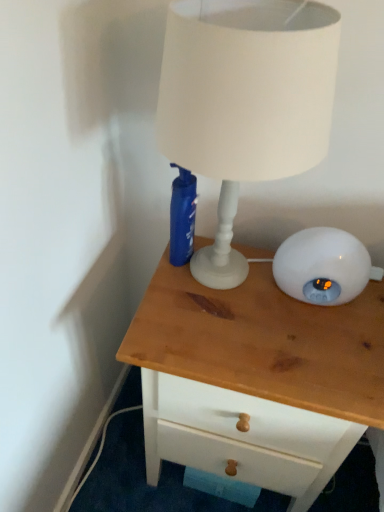
Measure the distance between wooden chest of drawers at center and camera.

wooden chest of drawers at center and camera are 26.26 inches apart.

The image size is (384, 512). What are the coordinates of `wooden chest of drawers at center` in the screenshot? It's located at (265, 343).

What do you see at coordinates (265, 343) in the screenshot? I see `wooden chest of drawers at center` at bounding box center [265, 343].

At what (x,y) coordinates should I click in order to perform the action: click on white matte lampshade at upper center. Please return your answer as a coordinate pair (x, y). The height and width of the screenshot is (512, 384). Looking at the image, I should click on (245, 102).

Describe the element at coordinates (245, 102) in the screenshot. I see `white matte lampshade at upper center` at that location.

Locate an element on the screen. wooden chest of drawers at center is located at coordinates (265, 343).

From the picture: Can you confirm if white matte lampshade at upper center is positioned to the right of wooden chest of drawers at center?

Incorrect, white matte lampshade at upper center is not on the right side of wooden chest of drawers at center.

Who is more distant, white matte lampshade at upper center or wooden chest of drawers at center?

wooden chest of drawers at center is further away from the camera.

Considering the positions of points (219, 172) and (132, 327), is point (219, 172) closer to camera compared to point (132, 327)?

Yes, point (219, 172) is in front of point (132, 327).

In the scene shown: From the image's perspective, is white matte lampshade at upper center over wooden chest of drawers at center?

Yes, from the image's perspective, white matte lampshade at upper center is on top of wooden chest of drawers at center.

From a real-world perspective, is white matte lampshade at upper center on wooden chest of drawers at center?

Yes, from a real-world perspective, white matte lampshade at upper center is above wooden chest of drawers at center.

Does white matte lampshade at upper center have a greater width compared to wooden chest of drawers at center?

No.

Can you confirm if white matte lampshade at upper center is shorter than wooden chest of drawers at center?

Yes, white matte lampshade at upper center is shorter than wooden chest of drawers at center.

Between white matte lampshade at upper center and wooden chest of drawers at center, which one has larger size?

Bigger between the two is wooden chest of drawers at center.

Is white matte lampshade at upper center spatially inside wooden chest of drawers at center, or outside of it?

white matte lampshade at upper center is spatially situated outside wooden chest of drawers at center.

Are white matte lampshade at upper center and wooden chest of drawers at center located far from each other?

No, there isn't a large distance between white matte lampshade at upper center and wooden chest of drawers at center.

Is white matte lampshade at upper center aimed at wooden chest of drawers at center?

No, white matte lampshade at upper center is not aimed at wooden chest of drawers at center.

The height and width of the screenshot is (512, 384). I want to click on lamp that is on the left side of wooden chest of drawers at center, so click(x=245, y=102).

Is wooden chest of drawers at center to the left of white matte lampshade at upper center from the viewer's perspective?

In fact, wooden chest of drawers at center is to the right of white matte lampshade at upper center.

In the image, is wooden chest of drawers at center positioned in front of or behind white matte lampshade at upper center?

Visually, wooden chest of drawers at center is located behind white matte lampshade at upper center.

Is point (257, 255) closer or farther from the camera than point (262, 18)?

Point (257, 255) is farther from the camera than point (262, 18).

From the image's perspective, is wooden chest of drawers at center located beneath white matte lampshade at upper center?

Correct, wooden chest of drawers at center appears lower than white matte lampshade at upper center in the image.

From a real-world perspective, is wooden chest of drawers at center physically located above or below white matte lampshade at upper center?

Clearly, from a real-world perspective, wooden chest of drawers at center is below white matte lampshade at upper center.

Can you confirm if wooden chest of drawers at center is wider than white matte lampshade at upper center?

Yes, wooden chest of drawers at center is wider than white matte lampshade at upper center.

Is wooden chest of drawers at center taller or shorter than white matte lampshade at upper center?

wooden chest of drawers at center is taller than white matte lampshade at upper center.

Based on their sizes in the image, would you say wooden chest of drawers at center is bigger or smaller than white matte lampshade at upper center?

Considering their sizes, wooden chest of drawers at center takes up more space than white matte lampshade at upper center.

Could white matte lampshade at upper center be considered to be inside wooden chest of drawers at center?

Definitely not — white matte lampshade at upper center is not inside wooden chest of drawers at center.

Does wooden chest of drawers at center touch white matte lampshade at upper center?

No, wooden chest of drawers at center is not with white matte lampshade at upper center.

Is wooden chest of drawers at center looking in the opposite direction of white matte lampshade at upper center?

wooden chest of drawers at center is not turned away from white matte lampshade at upper center.

Can you tell me how much wooden chest of drawers at center and white matte lampshade at upper center differ in facing direction?

3.15 degrees.

From the picture: Measure the distance between wooden chest of drawers at center and white matte lampshade at upper center.

10.25 inches.

Image resolution: width=384 pixels, height=512 pixels. I want to click on lamp on the left of the wooden chest of drawers at center, so click(x=245, y=102).

Locate an element on the screen. This screenshot has width=384, height=512. lamp above the wooden chest of drawers at center (from the image's perspective) is located at coordinates (245, 102).

In the image, there is a white matte lampshade at upper center. In order to click on the chest of drawers below it (from the image's perspective) in this screenshot , I will do `click(265, 343)`.